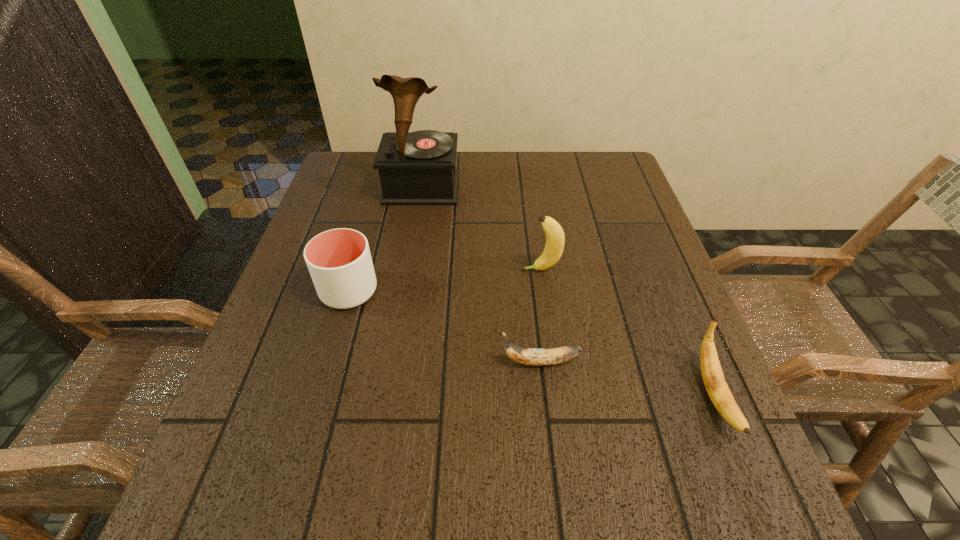
Where is `banana that stands as the closest to the farthest banana`? banana that stands as the closest to the farthest banana is located at coordinates point(527,356).